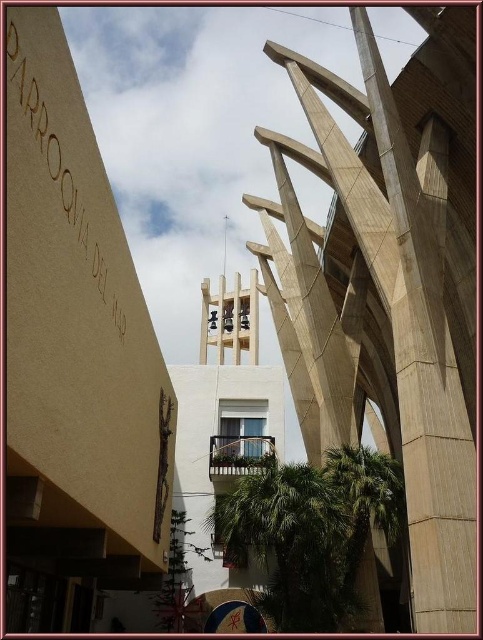
Which is below, beige stone structure at center or green leafy palm tree at lower center?

green leafy palm tree at lower center

In the scene shown: Is beige stone structure at center wider than green leafy palm tree at lower center?

Correct, the width of beige stone structure at center exceeds that of green leafy palm tree at lower center.

This screenshot has width=483, height=640. What do you see at coordinates (389, 285) in the screenshot? I see `beige stone structure at center` at bounding box center [389, 285].

Identify the location of beige stone structure at center. The height and width of the screenshot is (640, 483). (389, 285).

Between point (320, 502) and point (372, 476), which one is positioned in front?

Point (320, 502) is more forward.

Measure the distance between point (230, 552) and camera.

Point (230, 552) is 58.76 meters from camera.

Which is behind, point (330, 486) or point (385, 502)?

The point (385, 502) is more distant.

You are a GUI agent. You are given a task and a screenshot of the screen. Output one action in this format:
    pyautogui.click(x=<x>, y=<y>)
    Task: Click on the green leafy palm tree at center
    The height and width of the screenshot is (640, 483).
    Given the screenshot: What is the action you would take?
    pyautogui.click(x=290, y=541)

Can you confirm if gold cardboard sign at upper left is positioned below green leafy palm tree at lower center?

Actually, gold cardboard sign at upper left is above green leafy palm tree at lower center.

Measure the distance between point [43,8] and camera.

Point [43,8] is 22.91 meters from camera.

Which is in front, point (104, 214) or point (359, 547)?

Point (104, 214) is more forward.

The image size is (483, 640). I want to click on gold cardboard sign at upper left, so click(59, 154).